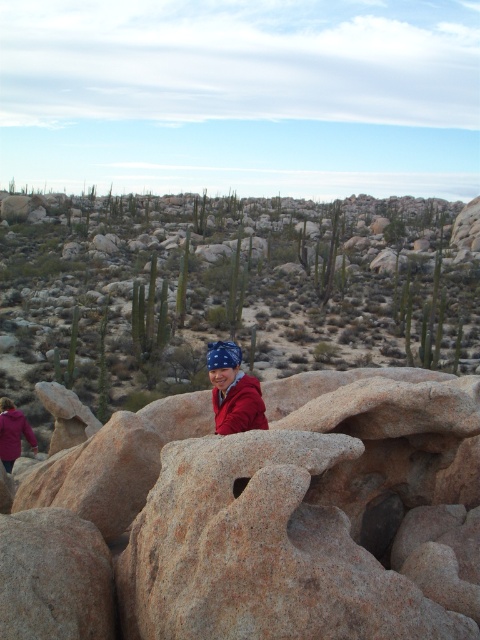
Question: Which of the following is the farthest from the observer?

Choices:
 (A) brown rough rock at center
 (B) matte red jacket at center
 (C) matte red jacket at lower left

Answer: (C)

Question: Does brown rough rock at center appear on the left side of matte red jacket at center?

Choices:
 (A) no
 (B) yes

Answer: (B)

Question: Does brown rough rock at center appear over matte red jacket at lower left?

Choices:
 (A) no
 (B) yes

Answer: (B)

Question: Which of the following is the closest to the observer?

Choices:
 (A) (0, 444)
 (B) (360, 416)

Answer: (B)

Question: Which of the following is the closest to the observer?

Choices:
 (A) (396, 544)
 (B) (214, 380)

Answer: (A)

Question: Is matte red jacket at center above matte red jacket at lower left?

Choices:
 (A) no
 (B) yes

Answer: (B)